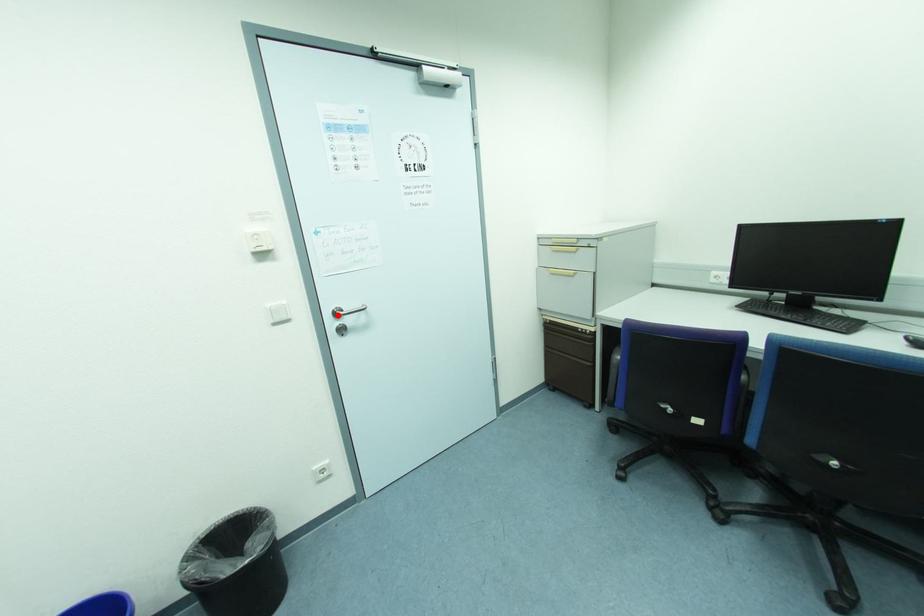
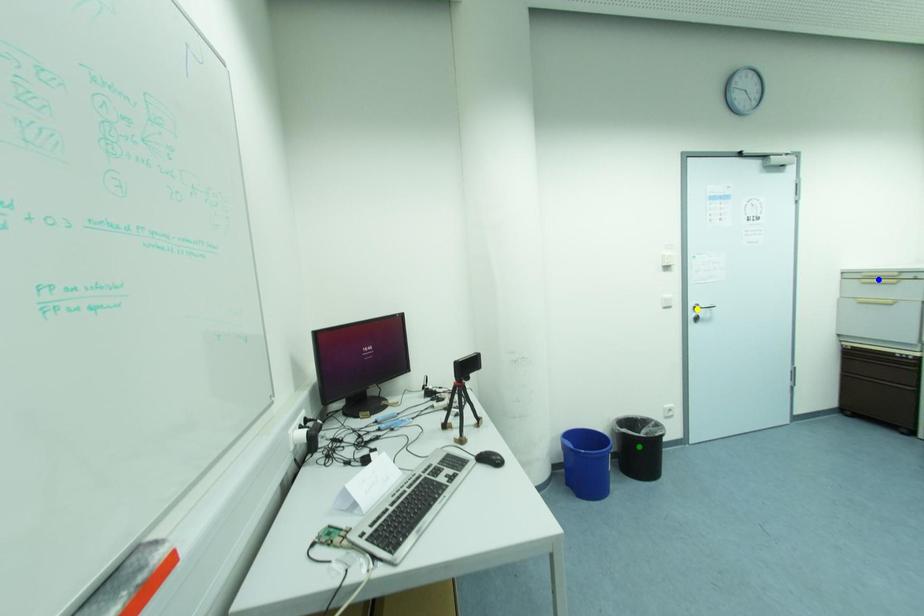
Question: I am providing you with two images of the same scene from different viewpoints. A red point is marked on the first image. You are given multiple points on the second image. Can you choose the point in image 2 that corresponds to the point in image 1?

Choices:
 (A) blue point
 (B) yellow point
 (C) green point

Answer: (B)